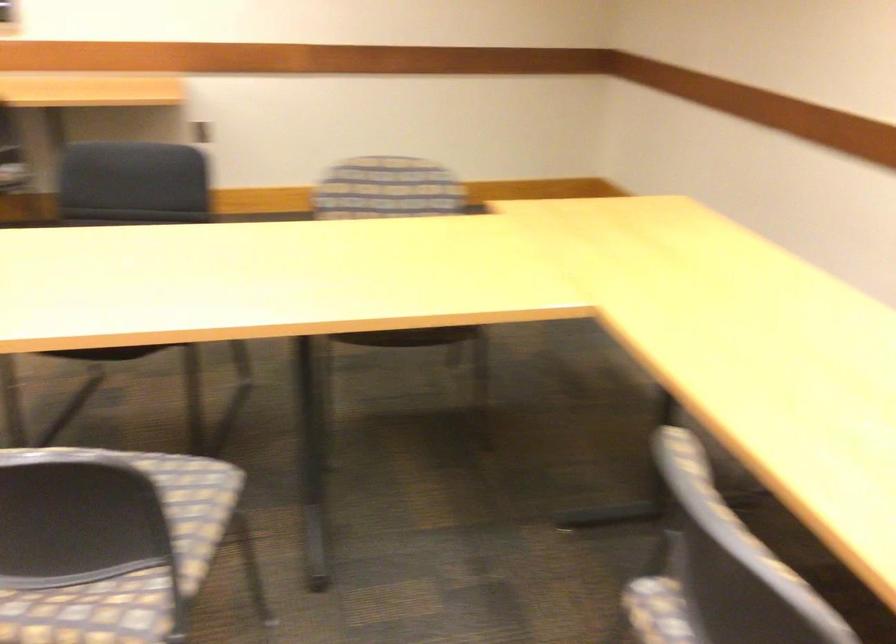
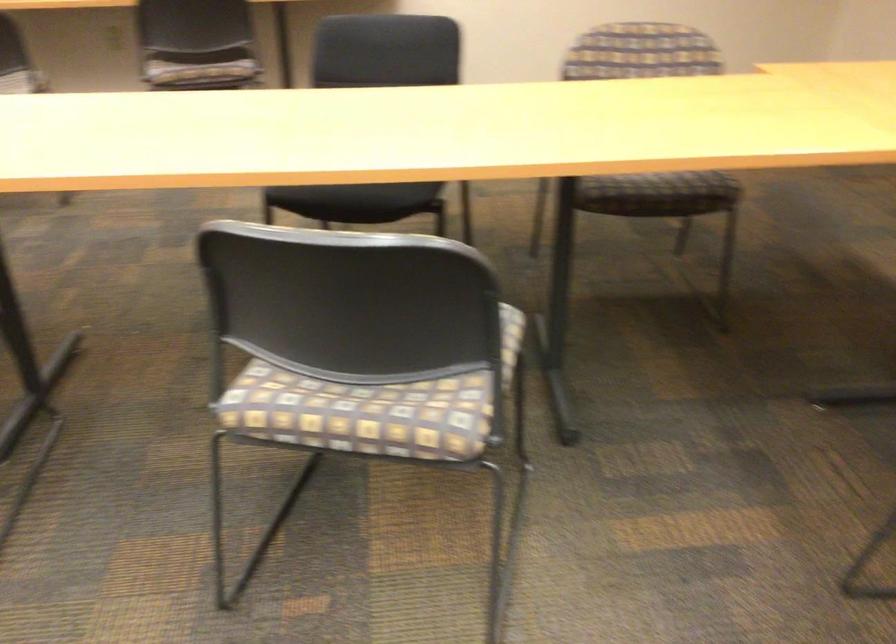
Question: In a continuous first-person perspective shot, in which direction is the camera moving?

Choices:
 (A) Left
 (B) Right
 (C) Forward
 (D) Backward

Answer: (A)